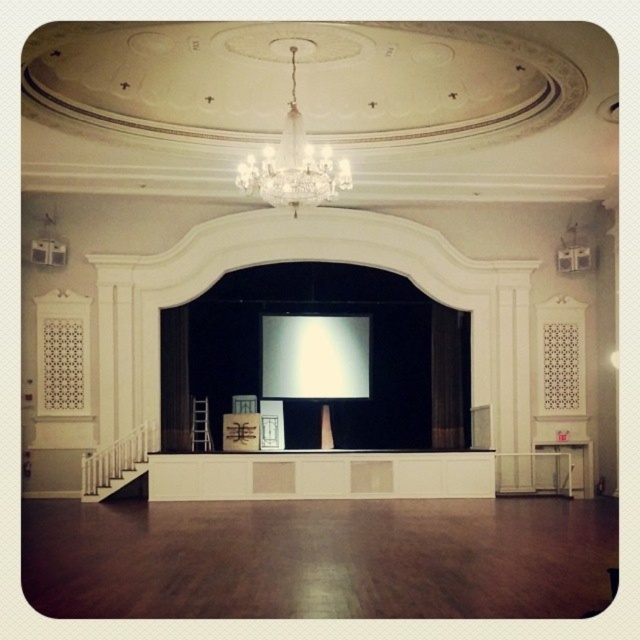
Can you confirm if white glossy projection screen at center is positioned below crystal glass chandelier at upper center?

Correct, white glossy projection screen at center is located below crystal glass chandelier at upper center.

Who is taller, white glossy projection screen at center or crystal glass chandelier at upper center?

white glossy projection screen at center

Where is `white glossy projection screen at center`? white glossy projection screen at center is located at coordinates (314, 356).